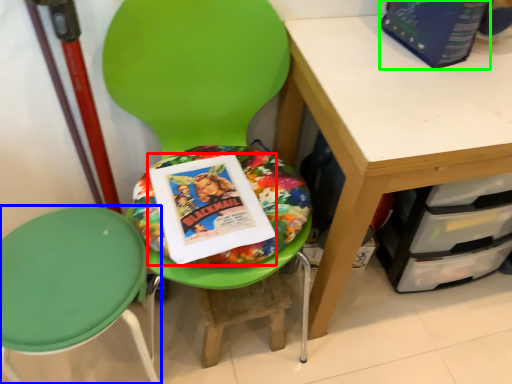
Question: Which object is the closest to the paperback book (highlighted by a red box)? Choose among these: chair (highlighted by a blue box) or paperback book (highlighted by a green box).

Choices:
 (A) chair
 (B) paperback book

Answer: (A)